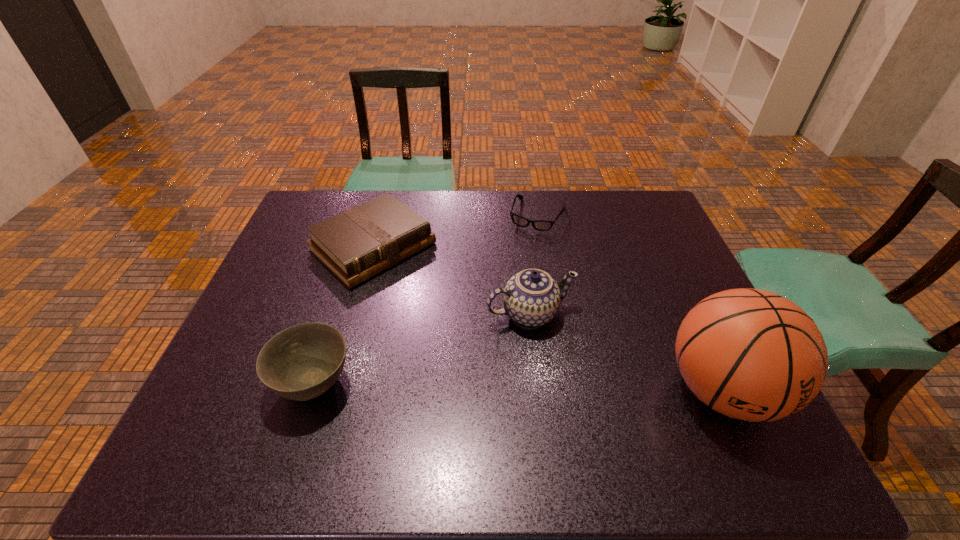
You are a GUI agent. You are given a task and a screenshot of the screen. Output one action in this format:
    pyautogui.click(x=<x>, y=<y>)
    Task: Click on the third tallest object
    This screenshot has height=540, width=960.
    Given the screenshot: What is the action you would take?
    pyautogui.click(x=302, y=362)

What are the coordinates of `the rightmost object` in the screenshot? It's located at (753, 355).

Where is `the tallest object`? This screenshot has width=960, height=540. the tallest object is located at coordinates (753, 355).

The image size is (960, 540). What are the coordinates of `spectacles` in the screenshot? It's located at (541, 225).

You are a GUI agent. You are given a task and a screenshot of the screen. Output one action in this format:
    pyautogui.click(x=<x>, y=<y>)
    Task: Click on the fourth tallest object
    
    Given the screenshot: What is the action you would take?
    pyautogui.click(x=359, y=243)

This screenshot has width=960, height=540. I want to click on the third farthest object, so click(531, 297).

Where is `chinaware`? chinaware is located at coordinates (531, 297).

Where is `vacant space situated on the right of the bowl`? vacant space situated on the right of the bowl is located at coordinates (439, 383).

The width and height of the screenshot is (960, 540). I want to click on free space located on the front-facing side of the shortest object, so click(507, 285).

I want to click on vacant area situated 0.200m on the front-facing side of the shortest object, so click(x=512, y=273).